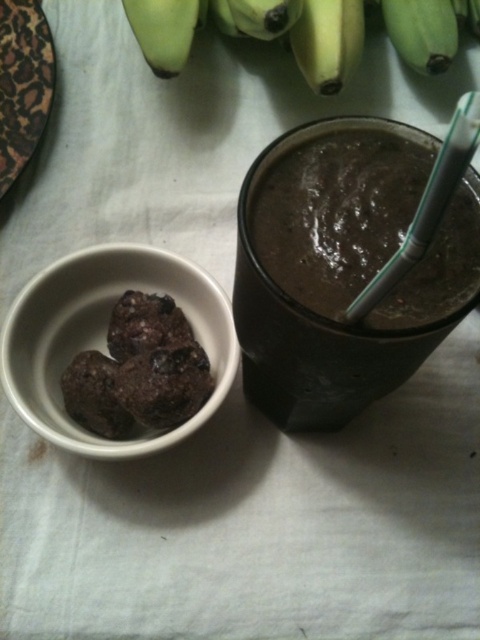
You are a food stylist arranging items on a table. You have a smooth dark chocolate pudding at center and a green matte banana at upper left. Which item takes up more horizontal space on the table?

The smooth dark chocolate pudding at center takes up more horizontal space because its width is larger than the green matte banana at upper left.

You are setting up a table for a dessert tasting event. You have a smooth dark chocolate pudding at center and a green matte banana at upper left. Which item is closer to the guests sitting at the table?

The smooth dark chocolate pudding at center is closer to the guests because it is in front of the green matte banana at upper left, meaning it is positioned nearer to the guests.